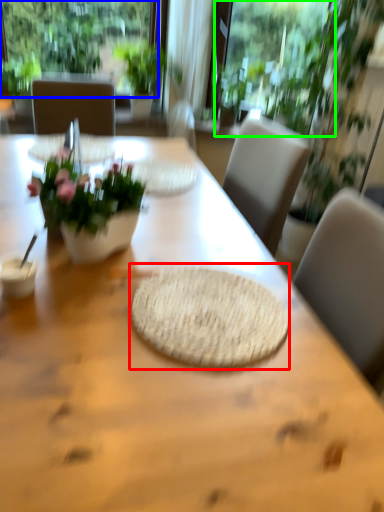
Question: Based on their relative distances, which object is nearer to mat (highlighted by a red box)? Choose from window (highlighted by a blue box) and window screen (highlighted by a green box).

Choices:
 (A) window
 (B) window screen

Answer: (B)